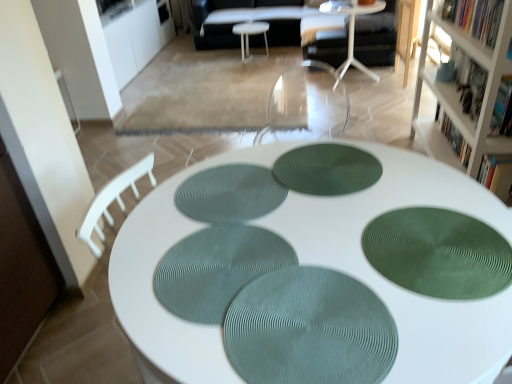
The height and width of the screenshot is (384, 512). I want to click on vacant area situated below green textured mat at lower right, marked as the first mat in a right-to-left arrangement (from a real-world perspective), so click(x=413, y=243).